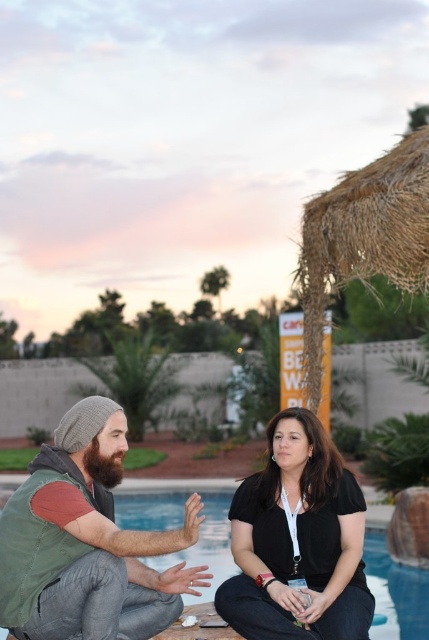
Which is below, green textured vest at center or blue smooth water at center?

blue smooth water at center

Who is taller, green textured vest at center or blue smooth water at center?

Answer: With more height is green textured vest at center.

Is point (97, 545) less distant than point (401, 576)?

Yes, it is.

The width and height of the screenshot is (429, 640). What are the coordinates of `green textured vest at center` in the screenshot? It's located at (87, 541).

Does green textured vest at center have a greater width compared to black matte shirt at center?

Yes, green textured vest at center is wider than black matte shirt at center.

Is green textured vest at center closer to the viewer compared to black matte shirt at center?

That is True.

Who is more forward, (44, 480) or (347, 525)?

Point (44, 480) is more forward.

Identify the location of green textured vest at center. This screenshot has width=429, height=640. (87, 541).

Which is in front, point (305, 529) or point (144, 497)?

Point (305, 529) is more forward.

Who is positioned more to the right, black matte shirt at center or blue smooth water at center?

black matte shirt at center is more to the right.

Describe the element at coordinates (298, 540) in the screenshot. I see `black matte shirt at center` at that location.

In order to click on black matte shirt at center in this screenshot , I will do `click(298, 540)`.